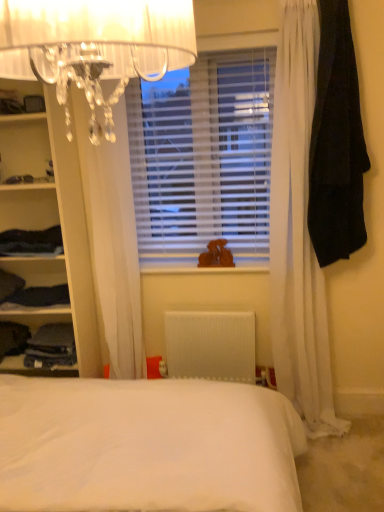
Find the location of a particular element. This screenshot has width=384, height=512. denim pants at left, which is the fifth clothing from right to left is located at coordinates (9, 285).

What is the approximate width of denim pants at left, which is the second clothing in left-to-right order?

11.11 inches.

The image size is (384, 512). Describe the element at coordinates (51, 347) in the screenshot. I see `dark blue fabric at left, the second clothing viewed from the right` at that location.

What is the approximate width of dark blue fabric at left, the second clothing viewed from the right?

The width of dark blue fabric at left, the second clothing viewed from the right, is 28.59 centimeters.

Locate an element on the screen. dark blue fabric at left, the 3th clothing in the right-to-left sequence is located at coordinates (41, 296).

Image resolution: width=384 pixels, height=512 pixels. What do you see at coordinates (95, 46) in the screenshot?
I see `translucent crystal chandelier at upper left` at bounding box center [95, 46].

You are a GUI agent. You are given a task and a screenshot of the screen. Output one action in this format:
    pyautogui.click(x=<x>, y=<y>)
    Task: Click on the black fabric at right, the 1th clothing in the right-to-left sequence
    This screenshot has width=384, height=512.
    Given the screenshot: What is the action you would take?
    pyautogui.click(x=336, y=143)

Is point (32, 253) positioned behind point (315, 147)?

Yes.

Is the position of dark blue fabric at left, acting as the third clothing starting from the left, more distant than that of black fabric at right, the 1th clothing in the right-to-left sequence?

Yes, dark blue fabric at left, acting as the third clothing starting from the left, is further from the camera.

Consider the image. From the image's perspective, which one is positioned higher, dark blue fabric at left, acting as the third clothing starting from the left, or black fabric at right, the 6th clothing in the left-to-right sequence?

black fabric at right, the 6th clothing in the left-to-right sequence.

Considering the relative sizes of dark blue fabric at left, the 4th clothing viewed from the right, and black fabric at right, the 1th clothing in the right-to-left sequence, in the image provided, is dark blue fabric at left, the 4th clothing viewed from the right, thinner than black fabric at right, the 1th clothing in the right-to-left sequence,?

In fact, dark blue fabric at left, the 4th clothing viewed from the right, might be wider than black fabric at right, the 1th clothing in the right-to-left sequence.

Where is `radiator to the right of matte white shelves at left`? The image size is (384, 512). radiator to the right of matte white shelves at left is located at coordinates click(210, 345).

From the picture: From the image's perspective, which one is positioned lower, matte white shelves at left or white plastic radiator at center?

white plastic radiator at center, from the image's perspective.

Is matte white shelves at left turned away from white plastic radiator at center?

matte white shelves at left does not have its back to white plastic radiator at center.

Does dark blue fabric at left, positioned as the first clothing in left-to-right order, turn towards dark blue fabric at left, acting as the third clothing starting from the left?

No, dark blue fabric at left, positioned as the first clothing in left-to-right order, is not aimed at dark blue fabric at left, acting as the third clothing starting from the left.

From the image's perspective, is dark blue fabric at left, which is counted as the 6th clothing, starting from the right, under dark blue fabric at left, acting as the third clothing starting from the left?

Yes.

Considering the positions of objects dark blue fabric at left, which is counted as the 6th clothing, starting from the right, and dark blue fabric at left, the 4th clothing viewed from the right, in the image provided, who is more to the right, dark blue fabric at left, which is counted as the 6th clothing, starting from the right, or dark blue fabric at left, the 4th clothing viewed from the right,?

Positioned to the right is dark blue fabric at left, the 4th clothing viewed from the right.

Is dark blue fabric at left, which is counted as the 6th clothing, starting from the right, positioned behind dark blue fabric at left, acting as the third clothing starting from the left?

That is True.

Between dark blue fabric at left, acting as the third clothing starting from the left, and white plastic blinds at center, which one appears on the left side from the viewer's perspective?

dark blue fabric at left, acting as the third clothing starting from the left.

Consider the image. Would you say dark blue fabric at left, the 4th clothing viewed from the right, is outside white plastic blinds at center?

Indeed, dark blue fabric at left, the 4th clothing viewed from the right, is completely outside white plastic blinds at center.

Which of these two, dark blue fabric at left, the 4th clothing viewed from the right, or white plastic blinds at center, stands taller?

Standing taller between the two is white plastic blinds at center.

Is black fabric at right, the 1th clothing in the right-to-left sequence, looking in the opposite direction of white plastic radiator at center?

black fabric at right, the 1th clothing in the right-to-left sequence, does not have its back to white plastic radiator at center.

Can you confirm if black fabric at right, the 1th clothing in the right-to-left sequence, is taller than white plastic radiator at center?

Yes, black fabric at right, the 1th clothing in the right-to-left sequence, is taller than white plastic radiator at center.

Is the surface of black fabric at right, the 6th clothing in the left-to-right sequence, in direct contact with white plastic radiator at center?

No, black fabric at right, the 6th clothing in the left-to-right sequence, is not next to white plastic radiator at center.

Is dark blue fabric at left, acting as the third clothing starting from the left, directly adjacent to dark blue fabric at left, the second clothing viewed from the right?

No, dark blue fabric at left, acting as the third clothing starting from the left, is not in contact with dark blue fabric at left, the second clothing viewed from the right.

Could you tell me if dark blue fabric at left, the 4th clothing viewed from the right, is facing dark blue fabric at left, the second clothing viewed from the right?

No, dark blue fabric at left, the 4th clothing viewed from the right, is not turned towards dark blue fabric at left, the second clothing viewed from the right.

Can you confirm if dark blue fabric at left, the 4th clothing viewed from the right, is smaller than dark blue fabric at left, the second clothing viewed from the right?

Incorrect, dark blue fabric at left, the 4th clothing viewed from the right, is not smaller in size than dark blue fabric at left, the second clothing viewed from the right.

Is dark blue fabric at left, the 4th clothing viewed from the right, wider or thinner than dark blue fabric at left, the second clothing viewed from the right?

In the image, dark blue fabric at left, the 4th clothing viewed from the right, appears to be wider than dark blue fabric at left, the second clothing viewed from the right.

From the picture: Considering the relative sizes of translucent crystal chandelier at upper left and dark blue fabric at left, the 3th clothing in the right-to-left sequence, in the image provided, is translucent crystal chandelier at upper left thinner than dark blue fabric at left, the 3th clothing in the right-to-left sequence,?

No.

Is dark blue fabric at left, the 3th clothing in the right-to-left sequence, at the back of translucent crystal chandelier at upper left?

No.

The image size is (384, 512). In order to click on lamp above the dark blue fabric at left, the 3th clothing in the right-to-left sequence (from the image's perspective) in this screenshot , I will do `click(95, 46)`.

In the image, is translucent crystal chandelier at upper left positioned in front of or behind dark blue fabric at left, which is counted as the 4th clothing, starting from the left?

translucent crystal chandelier at upper left is in front of dark blue fabric at left, which is counted as the 4th clothing, starting from the left.

The width and height of the screenshot is (384, 512). What are the coordinates of `the 1st clothing positioned below the black fabric at right, the 1th clothing in the right-to-left sequence (from a real-world perspective)` in the screenshot? It's located at (31, 242).

The image size is (384, 512). In order to click on radiator on the right of matte white shelves at left in this screenshot , I will do `click(210, 345)`.

Estimate the real-world distances between objects in this image. Which object is further from black fabric at right, the 6th clothing in the left-to-right sequence, dark blue fabric at left, the second clothing viewed from the right, or denim pants at left, which is the second clothing in left-to-right order?

denim pants at left, which is the second clothing in left-to-right order, lies further to black fabric at right, the 6th clothing in the left-to-right sequence, than the other object.

Looking at the image, which one is located further to dark blue fabric at left, which is counted as the 4th clothing, starting from the left, white plastic blinds at center or dark blue fabric at left, the second clothing viewed from the right?

white plastic blinds at center is further to dark blue fabric at left, which is counted as the 4th clothing, starting from the left.

Which object lies further to the anchor point dark blue fabric at left, the 3th clothing in the right-to-left sequence, white plastic blinds at center or denim pants at left, which is the second clothing in left-to-right order?

white plastic blinds at center lies further to dark blue fabric at left, the 3th clothing in the right-to-left sequence, than the other object.

Based on their spatial positions, is matte white shelves at left or dark blue fabric at left, positioned as the first clothing in left-to-right order, closer to white plastic blinds at center?

matte white shelves at left is closer to white plastic blinds at center.

From the image, which object appears to be nearer to denim pants at left, which is the fifth clothing from right to left, dark blue fabric at left, the second clothing viewed from the right, or dark blue fabric at left, the 3th clothing in the right-to-left sequence?

dark blue fabric at left, the 3th clothing in the right-to-left sequence, is closer to denim pants at left, which is the fifth clothing from right to left.

From the image, which object appears to be nearer to denim pants at left, which is the fifth clothing from right to left, dark blue fabric at left, the 4th clothing viewed from the right, or black fabric at right, the 6th clothing in the left-to-right sequence?

dark blue fabric at left, the 4th clothing viewed from the right.

When comparing their distances from white plastic blinds at center, does dark blue fabric at left, which is counted as the 6th clothing, starting from the right, or dark blue fabric at left, acting as the 5th clothing starting from the left, seem further?

Based on the image, dark blue fabric at left, which is counted as the 6th clothing, starting from the right, appears to be further to white plastic blinds at center.

Estimate the real-world distances between objects in this image. Which object is further from translucent crystal chandelier at upper left, dark blue fabric at left, positioned as the first clothing in left-to-right order, or dark blue fabric at left, acting as the 5th clothing starting from the left?

Among the two, dark blue fabric at left, positioned as the first clothing in left-to-right order, is located further to translucent crystal chandelier at upper left.

Find the location of `clothing between denim pants at left, which is the second clothing in left-to-right order, and dark blue fabric at left, positioned as the first clothing in left-to-right order, vertically`. clothing between denim pants at left, which is the second clothing in left-to-right order, and dark blue fabric at left, positioned as the first clothing in left-to-right order, vertically is located at coordinates (41, 296).

Find the location of a particular element. This screenshot has height=512, width=384. clothing between dark blue fabric at left, the 3th clothing in the right-to-left sequence, and white plastic radiator at center, in the horizontal direction is located at coordinates (51, 347).

Find the location of a particular element. radiator situated between dark blue fabric at left, acting as the third clothing starting from the left, and black fabric at right, the 1th clothing in the right-to-left sequence, from left to right is located at coordinates (210, 345).

What are the coordinates of `window blind between translucent crystal chandelier at upper left and dark blue fabric at left, the 3th clothing in the right-to-left sequence, in the front-back direction` in the screenshot? It's located at (203, 158).